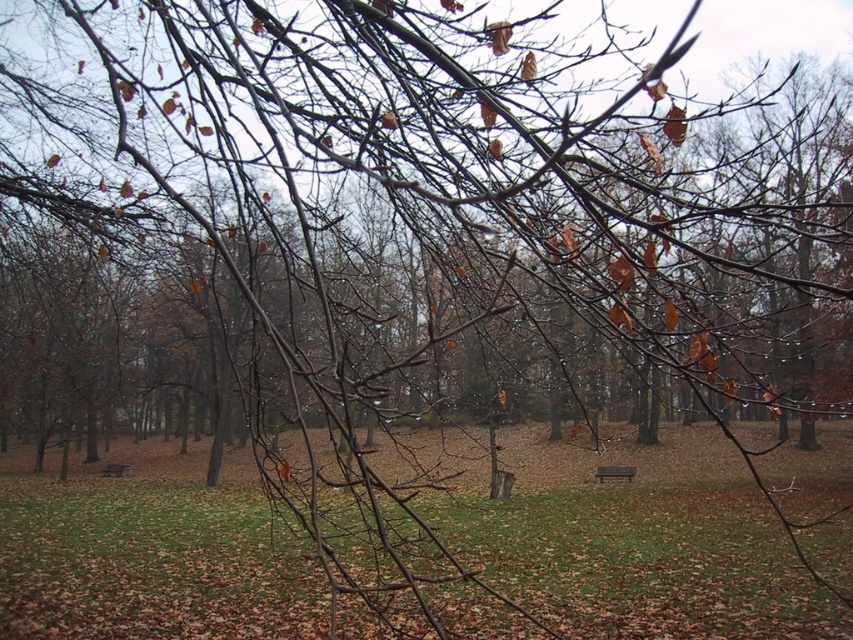
Question: Does brown wooden bench at center have a lesser width compared to wooden bench at center?

Choices:
 (A) no
 (B) yes

Answer: (B)

Question: Does brown wooden bench at center have a smaller size compared to wooden bench at center?

Choices:
 (A) yes
 (B) no

Answer: (A)

Question: Which of the following is the closest to the observer?

Choices:
 (A) (107, 468)
 (B) (602, 472)

Answer: (B)

Question: Observing the image, what is the correct spatial positioning of brown wooden bench at center in reference to wooden bench at center?

Choices:
 (A) left
 (B) right

Answer: (B)

Question: Which point is farther to the camera?

Choices:
 (A) (126, 468)
 (B) (631, 480)

Answer: (A)